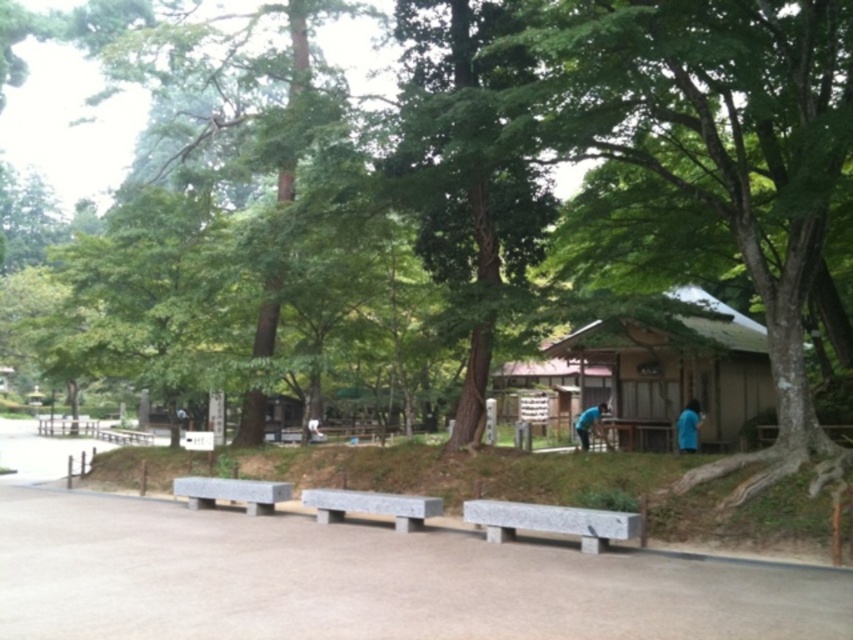
You are a park visitor standing on the paved pathway leading to the wooden structure. You notice the green leafy tree at center and the blue fabric shirt at center. Which object is bigger in size?

The green leafy tree at center has a larger size compared to the blue fabric shirt at center, so the green leafy tree at center is bigger.

You are standing at the point with coordinates [552,522] in the image. What object is located exactly at that point?

The gray granite bench at center is located exactly at point 0.816, 0.646.